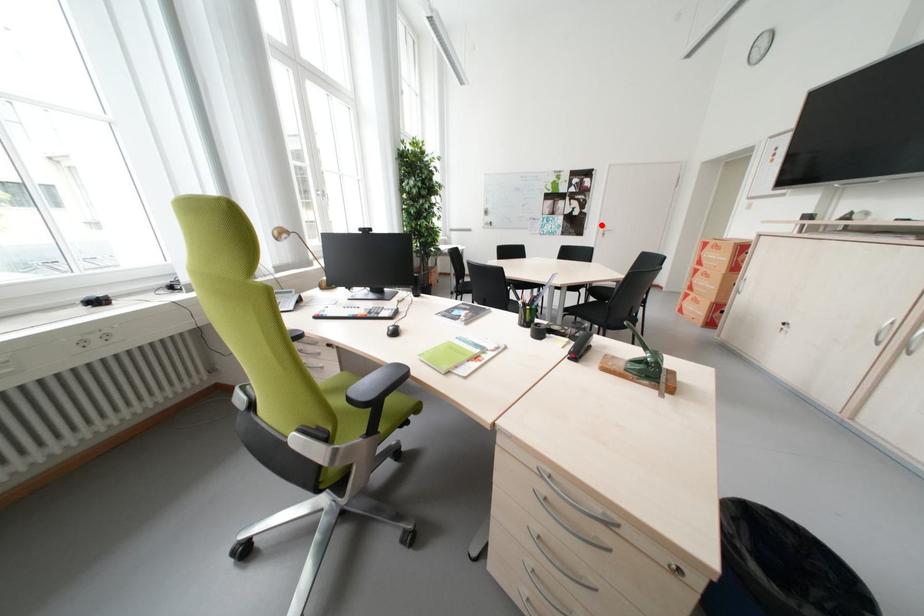
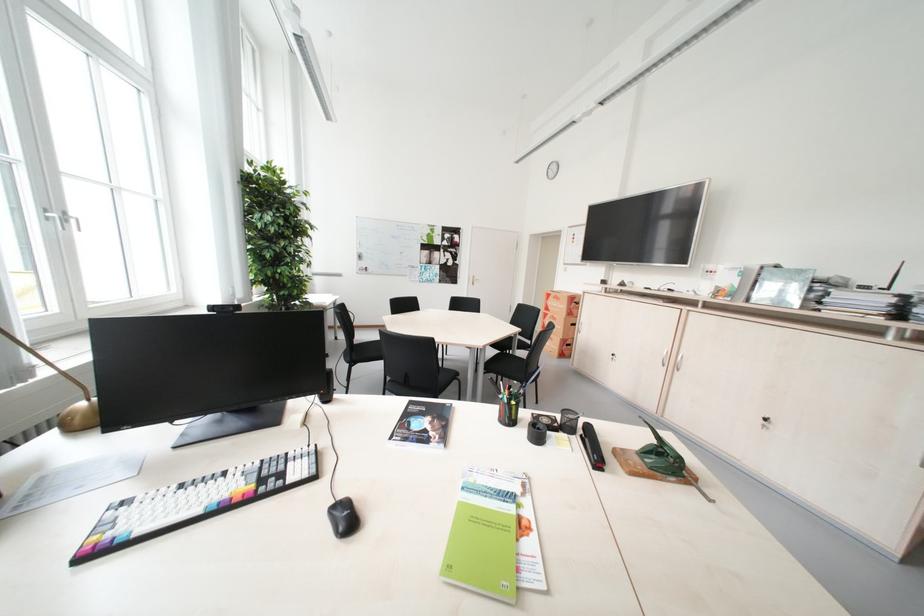
Question: I am providing you with two images of the same scene from different viewpoints. Given a red point in image1, look at the same physical point in image2. Is it:

Choices:
 (A) Closer to the viewpoint
 (B) Farther from the viewpoint

Answer: (B)